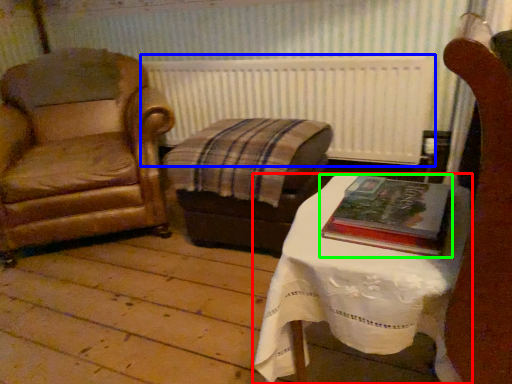
Question: Which object is the farthest from table (highlighted by a red box)? Choose among these: radiator (highlighted by a blue box) or book (highlighted by a green box).

Choices:
 (A) radiator
 (B) book

Answer: (A)